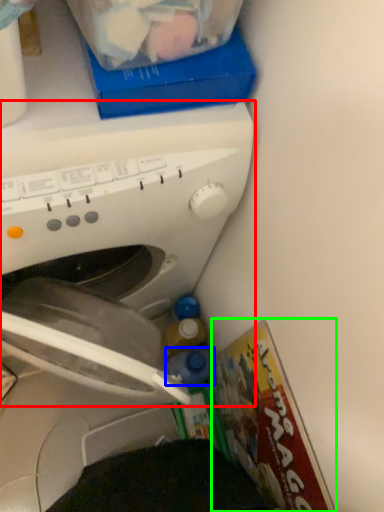
Question: Which object is positioned closest to washing machine (highlighted by a red box)? Select from bottle (highlighted by a blue box) and magazine (highlighted by a green box).

Choices:
 (A) bottle
 (B) magazine

Answer: (B)